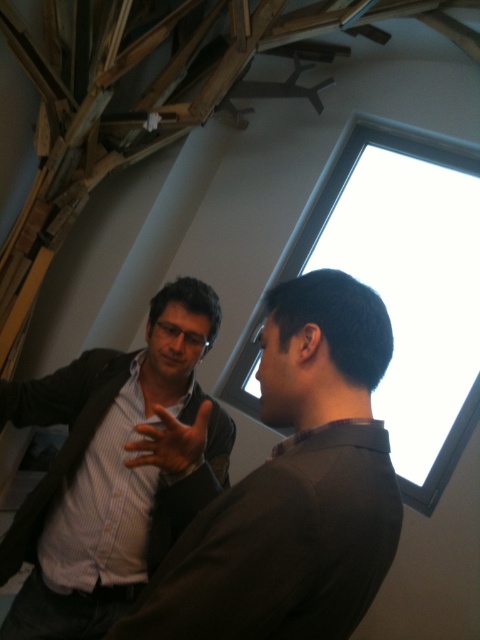
You are standing in the room and want to point to the exact location of the point marked at coordinates (x=294, y=488). Which object in the scene should you point to?

The point marked at coordinates (x=294, y=488) is located on the dark brown shirt at center.